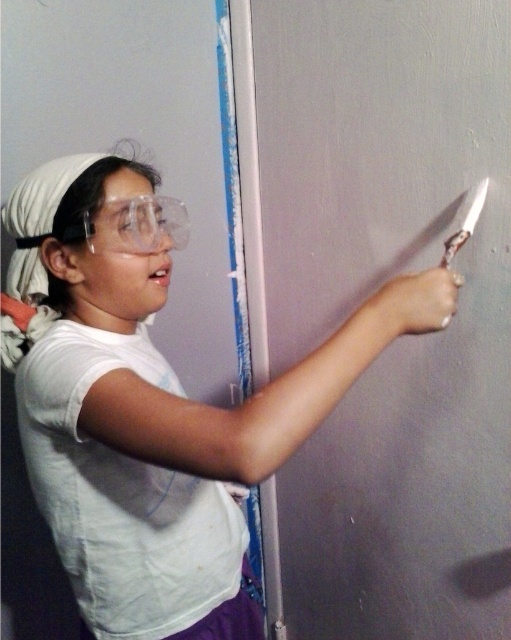
You are standing in front of the wall where the person is working. There are two points marked on the wall at coordinates point (x=68, y=216) and point (x=456, y=250). Which point is closer to you?

Point (x=68, y=216) is closer to the viewer than point (x=456, y=250).